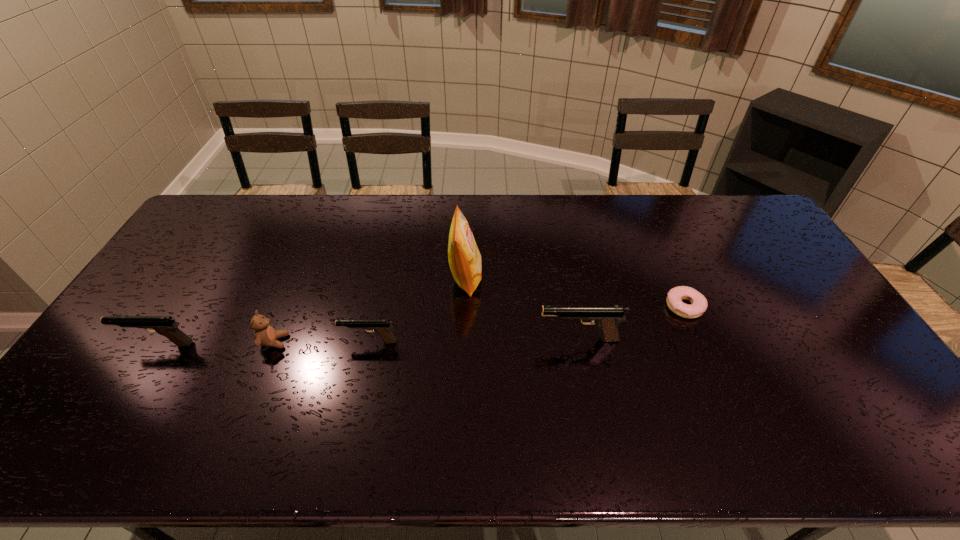
Please point a vacant point for placing a pistol on the right. Please provide its 2D coordinates. Your answer should be formatted as a tuple, i.e. [(x, y)], where the tuple contains the x and y coordinates of a point satisfying the conditions above.

[(785, 337)]